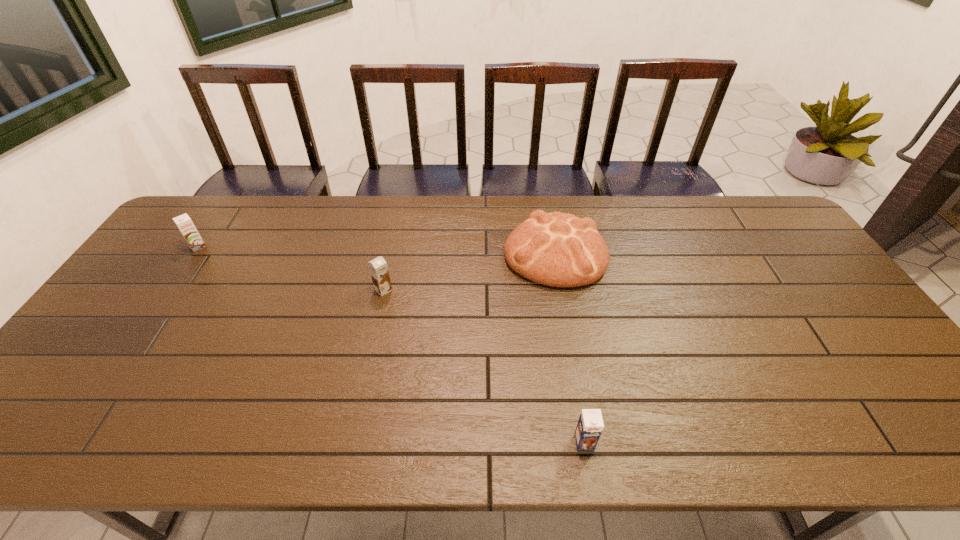
The width and height of the screenshot is (960, 540). I want to click on free area in between the farthest chocolate milk and the bread, so click(376, 250).

Locate an element on the screen. empty space between the bread and the nearest object is located at coordinates (570, 348).

Where is `vacant area that lies between the third object from right to left and the leftmost object`? This screenshot has width=960, height=540. vacant area that lies between the third object from right to left and the leftmost object is located at coordinates (291, 268).

The width and height of the screenshot is (960, 540). Identify the location of free spot between the leftmost chocolate milk and the second chocolate milk from right to left. (291, 268).

Where is `free space that is in between the bread and the second chocolate milk from right to left`? free space that is in between the bread and the second chocolate milk from right to left is located at coordinates (469, 272).

This screenshot has height=540, width=960. I want to click on blank region between the bread and the second object from left to right, so click(469, 272).

Identify which object is located as the second nearest to the farthest chocolate milk. Please provide its 2D coordinates. Your answer should be formatted as a tuple, i.e. [(x, y)], where the tuple contains the x and y coordinates of a point satisfying the conditions above.

[(555, 249)]

You are a GUI agent. You are given a task and a screenshot of the screen. Output one action in this format:
    pyautogui.click(x=<x>, y=<y>)
    Task: Click on the second closest object to the third object from right to left
    
    Given the screenshot: What is the action you would take?
    pyautogui.click(x=184, y=223)

The image size is (960, 540). Find the location of `chocolate milk object that ranks as the second closest to the bread`. chocolate milk object that ranks as the second closest to the bread is located at coordinates (590, 425).

Identify which chocolate milk is the closest to the third object from right to left. Please provide its 2D coordinates. Your answer should be formatted as a tuple, i.e. [(x, y)], where the tuple contains the x and y coordinates of a point satisfying the conditions above.

[(184, 223)]